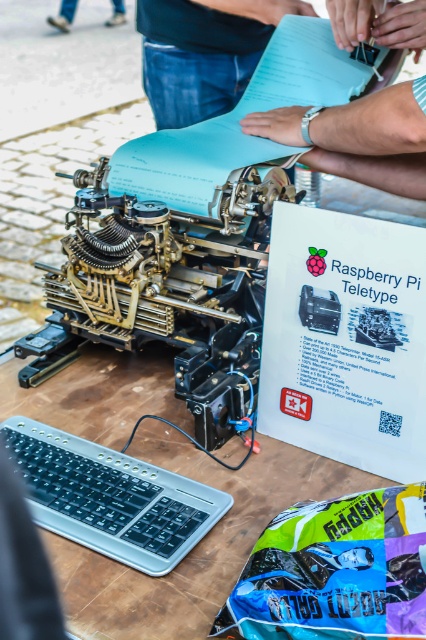
You are setting up a display for a tech exhibition and need to arrange the brass mechanical typewriter at center and the silver metallic keyboard at lower left on a table. Given their sizes, which object should be placed first to ensure they both fit properly?

The silver metallic keyboard at lower left should be placed first since it is smaller in width than the brass mechanical typewriter at center, allowing more space to accommodate the larger typewriter afterward.